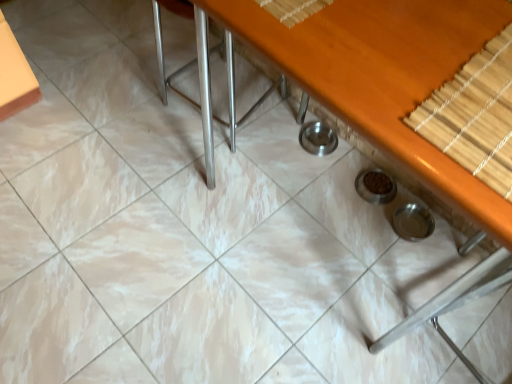
What are the coordinates of `free space to the left of bamboo mat at upper right` in the screenshot? It's located at (373, 68).